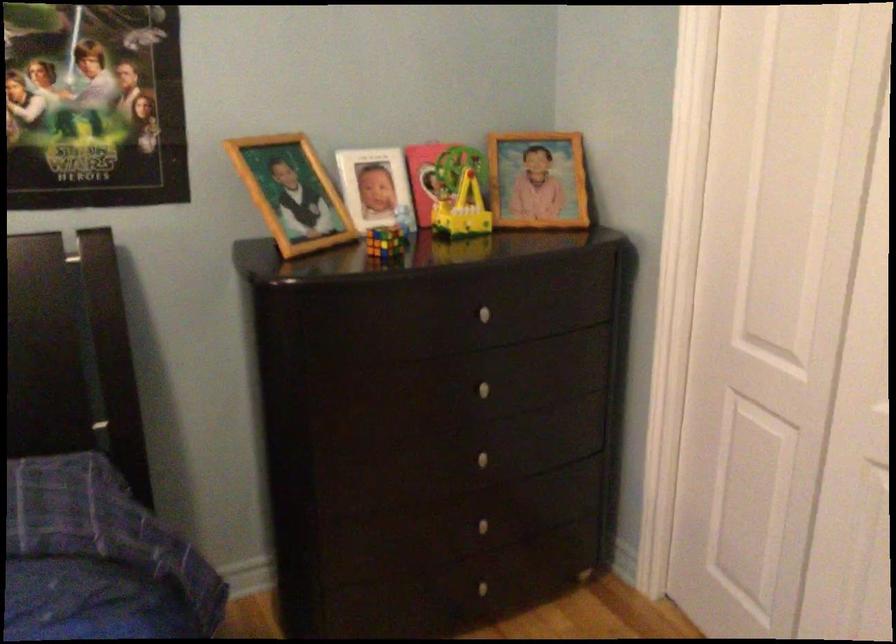
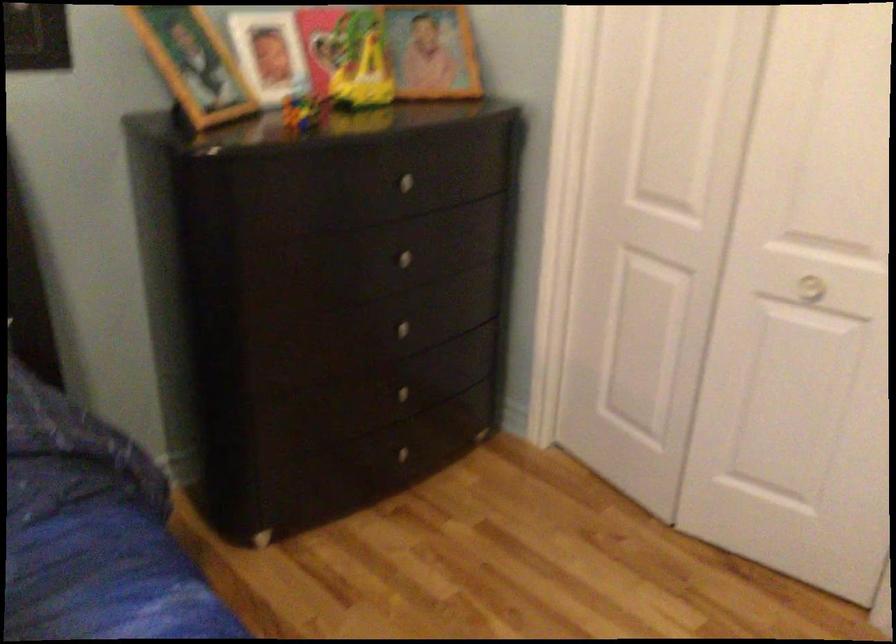
Where in the second image is the point corresponding to point (478, 386) from the first image?

(399, 258)